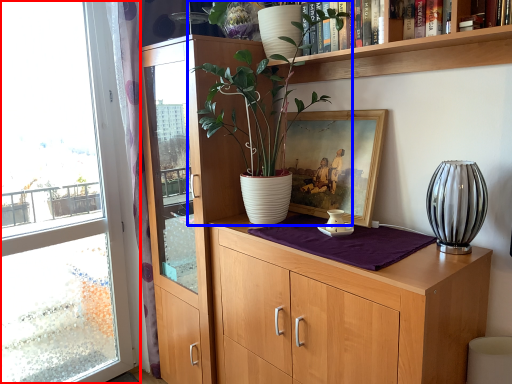
Question: Which of the following is the closest to the observer, window (highlighted by a red box) or houseplant (highlighted by a blue box)?

Choices:
 (A) window
 (B) houseplant

Answer: (B)